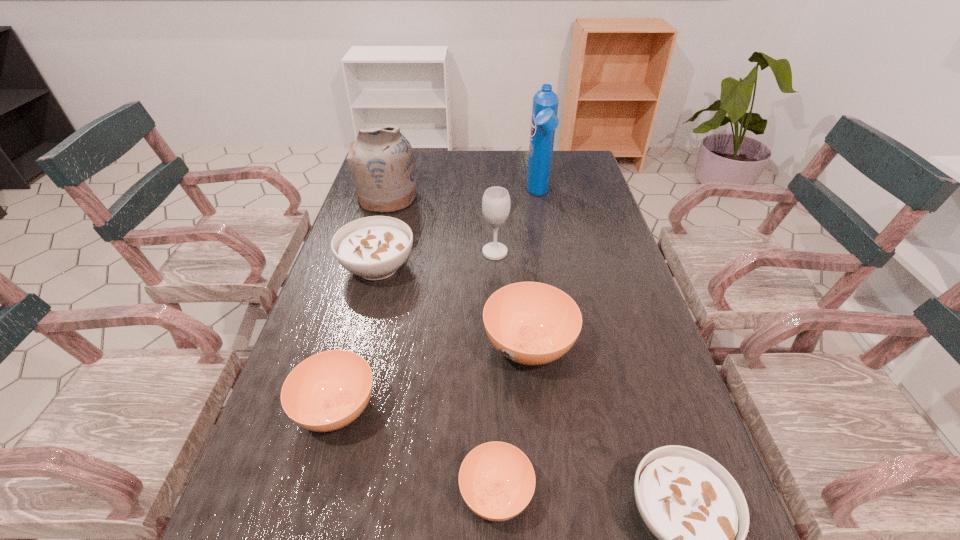
Locate an element on the screen. This screenshot has width=960, height=540. free space located 0.150m on the front of the pottery is located at coordinates (374, 244).

The width and height of the screenshot is (960, 540). I want to click on free point located 0.250m on the right of the third tallest object, so click(x=595, y=252).

Where is `free space located 0.240m on the front of the biggest peach soup bowl`? This screenshot has height=540, width=960. free space located 0.240m on the front of the biggest peach soup bowl is located at coordinates (545, 505).

You are a GUI agent. You are given a task and a screenshot of the screen. Output one action in this format:
    pyautogui.click(x=<x>, y=<y>)
    Task: Click on the free space located on the back of the farther white soup bowl
    This screenshot has height=540, width=960.
    Given the screenshot: What is the action you would take?
    pyautogui.click(x=393, y=211)

I want to click on free space located on the right of the leftmost peach soup bowl, so click(x=453, y=409).

You are a GUI agent. You are given a task and a screenshot of the screen. Output one action in this format:
    pyautogui.click(x=<x>, y=<y>)
    Task: Click on the free space located 0.240m on the right of the nearest peach soup bowl
    This screenshot has width=960, height=540.
    Given the screenshot: What is the action you would take?
    pyautogui.click(x=671, y=494)

Find the location of a particular element. object present at the far edge is located at coordinates (544, 121).

This screenshot has width=960, height=540. I want to click on pottery that is positioned at the left edge, so [x=381, y=160].

You are a GUI agent. You are given a task and a screenshot of the screen. Output one action in this format:
    pyautogui.click(x=<x>, y=<y>)
    Task: Click on the vacant space at the far edge of the desktop
    Image resolution: width=960 pixels, height=540 pixels.
    Given the screenshot: What is the action you would take?
    click(x=495, y=159)

This screenshot has width=960, height=540. I want to click on free space at the left edge of the desktop, so click(x=372, y=341).